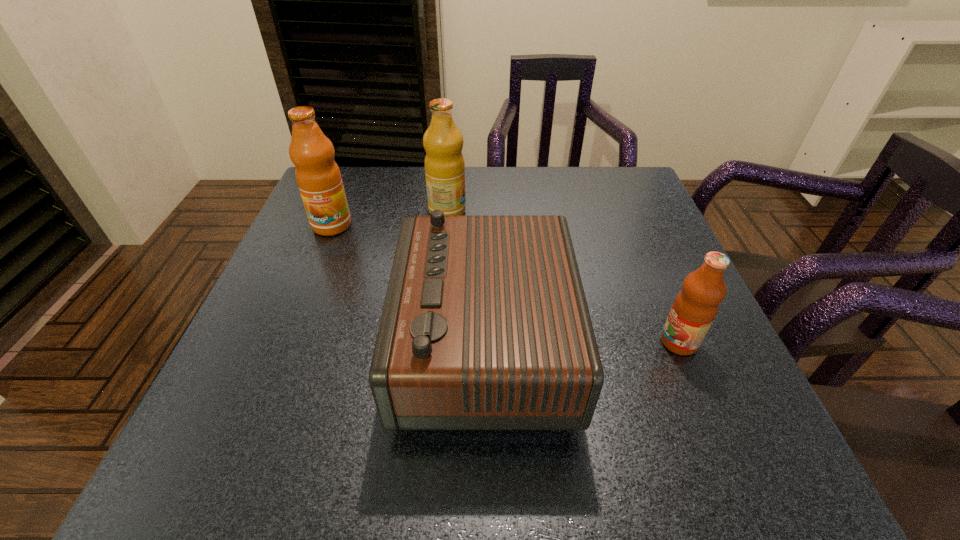
Where is `the leftmost fruit juice`? The height and width of the screenshot is (540, 960). the leftmost fruit juice is located at coordinates (319, 180).

Find the location of a particular element. The width and height of the screenshot is (960, 540). the second fruit juice from left to right is located at coordinates (444, 163).

This screenshot has height=540, width=960. Find the location of `the shortest fruit juice`. the shortest fruit juice is located at coordinates (695, 307).

I want to click on the nearest fruit juice, so pyautogui.click(x=695, y=307).

Locate an element on the screen. radio receiver is located at coordinates (485, 326).

I want to click on free location located on the label side of the leftmost fruit juice, so click(x=322, y=251).

I want to click on vacant position located 0.170m on the front label of the second fruit juice from right to left, so (x=534, y=212).

At what (x,y) coordinates should I click in order to perform the action: click on blank space located on the front label of the rightmost object. Please return your answer as a coordinate pair (x, y). Looking at the image, I should click on (502, 342).

Where is `vacant space located 0.200m on the front label of the rightmost object`? The width and height of the screenshot is (960, 540). vacant space located 0.200m on the front label of the rightmost object is located at coordinates (551, 342).

Find the location of a particular element. This screenshot has height=540, width=960. vacant area situated on the front label of the rightmost object is located at coordinates (502, 342).